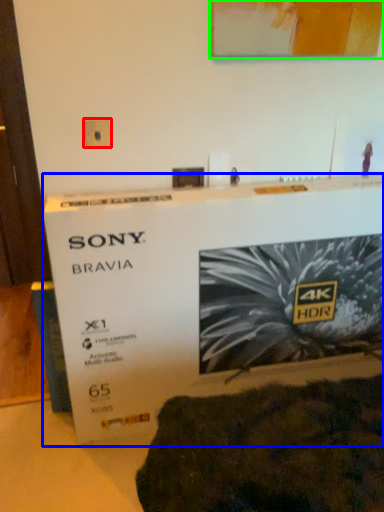
Question: Based on their relative distances, which object is farther from electric outlet (highlighted by a red box)? Choose from poster (highlighted by a blue box) and picture frame (highlighted by a green box).

Choices:
 (A) poster
 (B) picture frame

Answer: (A)